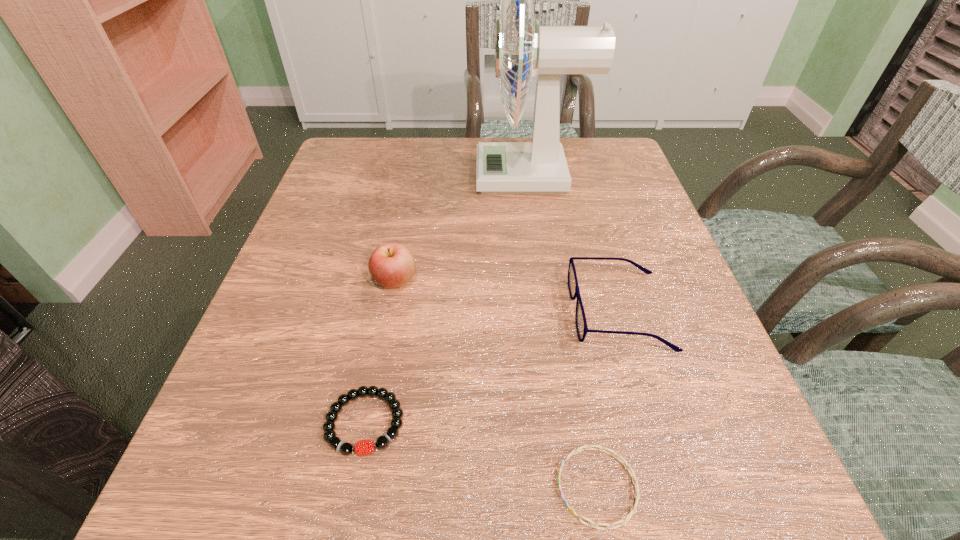
You are a GUI agent. You are given a task and a screenshot of the screen. Output one action in this format:
    pyautogui.click(x=<x>, y=<y>)
    Task: Click on the free space at the near left corner
    This screenshot has width=960, height=540.
    Given the screenshot: What is the action you would take?
    pyautogui.click(x=293, y=480)

At what (x,y) coordinates should I click in order to perform the action: click on vacant area at the far right corner. Please return your answer as a coordinate pair (x, y). This screenshot has height=540, width=960. Looking at the image, I should click on pyautogui.click(x=589, y=143).

At what (x,y) coordinates should I click in order to perform the action: click on free space between the spectacles and the fourth shortest object. Please return your answer as a coordinate pair (x, y). This screenshot has width=960, height=540. Looking at the image, I should click on (507, 296).

I want to click on vacant point located between the right bracelet and the fourth tallest object, so click(x=481, y=455).

This screenshot has width=960, height=540. I want to click on free area in between the fan and the taller bracelet, so click(448, 299).

This screenshot has height=540, width=960. Find the location of `vacant region between the right bracelet and the second tallest object`. vacant region between the right bracelet and the second tallest object is located at coordinates (496, 383).

This screenshot has height=540, width=960. Find the location of `vacant region between the shortest object and the left bracelet`. vacant region between the shortest object and the left bracelet is located at coordinates (481, 455).

You are a GUI agent. You are given a task and a screenshot of the screen. Output one action in this format:
    pyautogui.click(x=<x>, y=<y>)
    Task: Click on the vacant space that is in between the fourth shortest object and the taller bracelet
    This screenshot has width=960, height=540.
    Given the screenshot: What is the action you would take?
    pyautogui.click(x=380, y=352)

Where is `unoccupied position between the taller bracelet and the spectacles`? unoccupied position between the taller bracelet and the spectacles is located at coordinates (492, 367).

You are a GUI agent. You are given a task and a screenshot of the screen. Output one action in this format:
    pyautogui.click(x=<x>, y=<y>)
    Task: Click on the vacant space that's between the fourth shortest object and the third shortest object
    
    Given the screenshot: What is the action you would take?
    pyautogui.click(x=507, y=296)